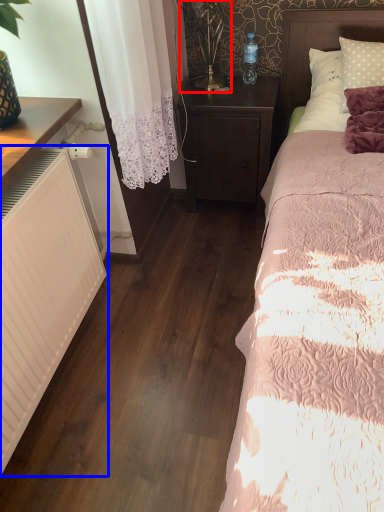
Question: Among these objects, which one is farthest to the camera, table lamp (highlighted by a red box) or heater (highlighted by a blue box)?

Choices:
 (A) table lamp
 (B) heater

Answer: (A)